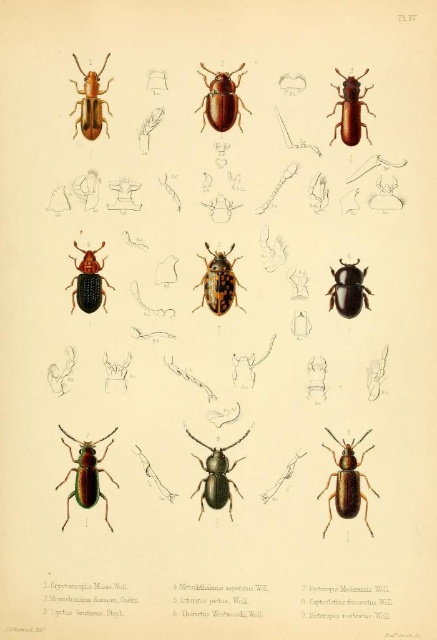
Between brown matte beetle at upper right and shiny dark brown beetle at center-right, which one appears on the left side from the viewer's perspective?

shiny dark brown beetle at center-right

Can you confirm if brown matte beetle at upper right is thinner than shiny dark brown beetle at center-right?

Yes, brown matte beetle at upper right is thinner than shiny dark brown beetle at center-right.

This screenshot has width=437, height=640. What do you see at coordinates (350, 109) in the screenshot?
I see `brown matte beetle at upper right` at bounding box center [350, 109].

Where is `brown matte beetle at upper right`? brown matte beetle at upper right is located at coordinates (350, 109).

Between brown matte beetle at center and marbled brown beetle at center, which one appears on the right side from the viewer's perspective?

brown matte beetle at center is more to the right.

Is brown matte beetle at center further to camera compared to marbled brown beetle at center?

No, it is in front of marbled brown beetle at center.

Is point (215, 90) positioned behind point (233, 273)?

No, (215, 90) is in front of (233, 273).

Locate an element on the screen. The height and width of the screenshot is (640, 437). brown matte beetle at center is located at coordinates (221, 99).

Does matte brown beetle at center lie in front of shiny dark brown beetle at center-right?

Yes.

Does point (225, 460) come behind point (329, 289)?

No, (225, 460) is in front of (329, 289).

Is point (231, 502) closer to viewer compared to point (339, 310)?

Yes, it is.

I want to click on matte brown beetle at center, so click(x=215, y=476).